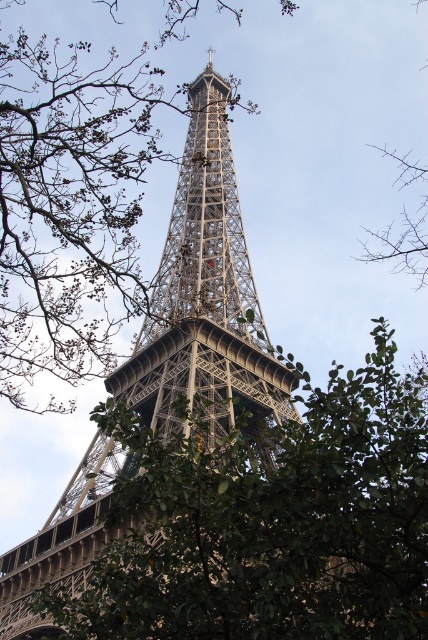
You are a photographer planning to capture the Eiffel Tower without any obstructions. You notice the green leafy tree at center and the bare branches at upper right in your current frame. Which object should you move your camera to avoid, considering their sizes?

The green leafy tree at center has a larger width than the bare branches at upper right, so you should move your camera to avoid the green leafy tree at center first as it is wider and more likely to block the view of the Eiffel Tower.

You are standing in front of the Eiffel Tower and notice two points marked on the tower. The first point is at coordinates point (146, 445) and the second is at point (389, 154). Which point is closer to your current position?

Point (146, 445) is in front of point (389, 154), so it is closer to your current position.

In the scene shown: You are standing in front of the Eiffel Tower and want to take a photo that includes both the point at coordinates (205, 292) and the branches in the foreground. Based on the scene description, where should you position yourself relative to the Eiffel Tower to ensure both elements are visible in your frame?

The point at coordinates (205, 292) corresponds to the metallic lattice tower at center. To include both this point and the branches in the foreground, you should position yourself in front of the Eiffel Tower at a low angle, as described in the scene, ensuring the branches framing the view are visible in the foreground while capturing the tower at center.